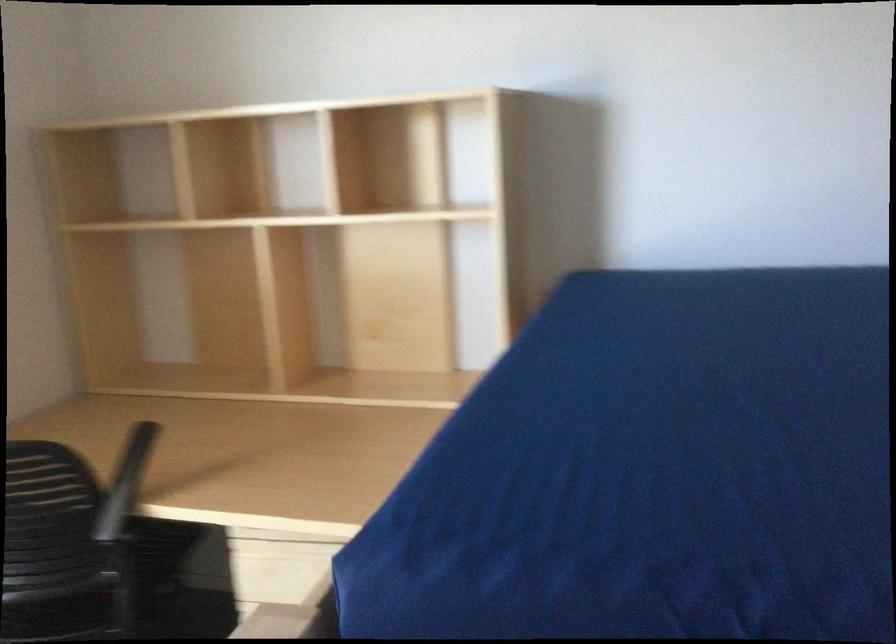
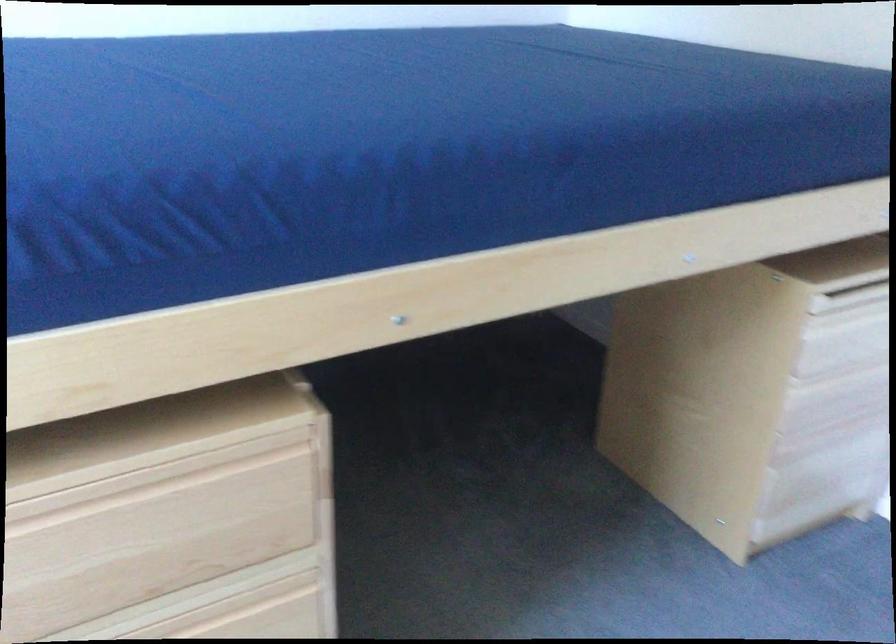
Question: The first image is from the beginning of the video and the second image is from the end. How did the camera likely rotate when shooting the video?

Choices:
 (A) Left
 (B) Right
 (C) Up
 (D) Down

Answer: (B)